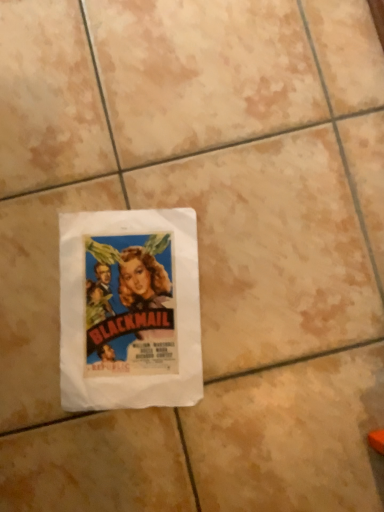
The width and height of the screenshot is (384, 512). Identify the location of free point above matte paper poster at center (from a real-world perspective). [x=123, y=297].